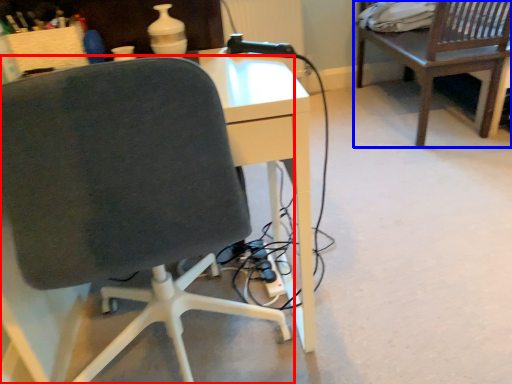
Question: Which of the following is the closest to the observer, chair (highlighted by a red box) or table (highlighted by a blue box)?

Choices:
 (A) chair
 (B) table

Answer: (A)